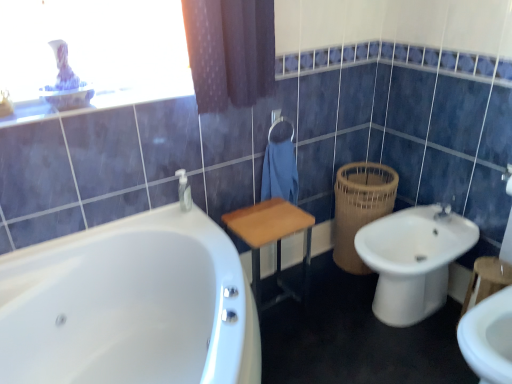
Identify the location of empty space that is in between white ceramic bidet at lower right and woven brown basket at right. (343, 281).